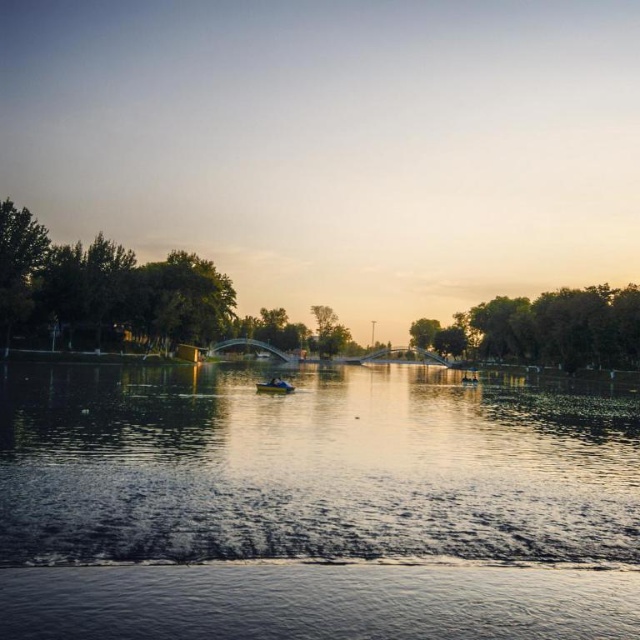
You are an observer standing on the lakeside. You see the green leafy trees at right and the green leafy tree at upper left. Which one is closer to you?

The green leafy trees at right is closer to you than the green leafy tree at upper left.

You are standing at the point marked by the coordinates point (422, 332) in the image. Looking around, what object is directly in front of you?

The point (422, 332) indicates a green leafy tree at center, so the green leafy tree at center is directly in front of you.

You are standing on the lakeside and want to take a photo of both the reflective water surface at center and the green leafy tree at center. Which object should you adjust your camera angle upwards to capture better?

You should adjust your camera angle upwards to capture the green leafy tree at center because it is taller than the reflective water surface at center.